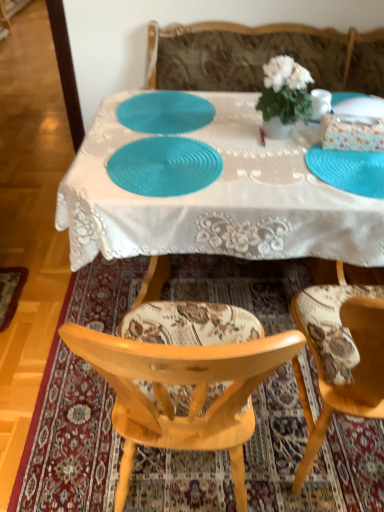
At what (x,y) coordinates should I click in order to perform the action: click on vacant space underneath white matte flower pot at center (from a real-world perspective). Please return your answer as a coordinate pair (x, y). The width and height of the screenshot is (384, 512). Looking at the image, I should click on (286, 132).